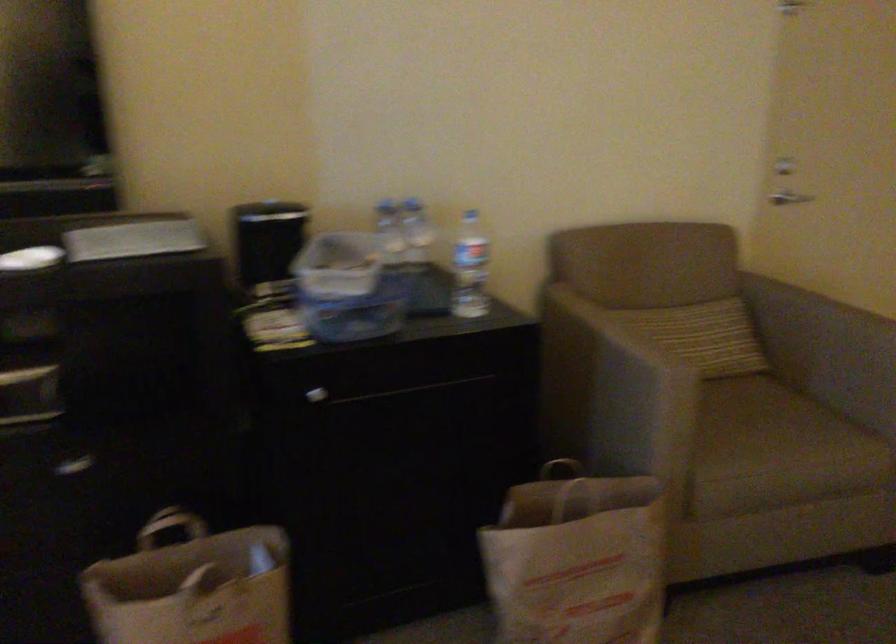
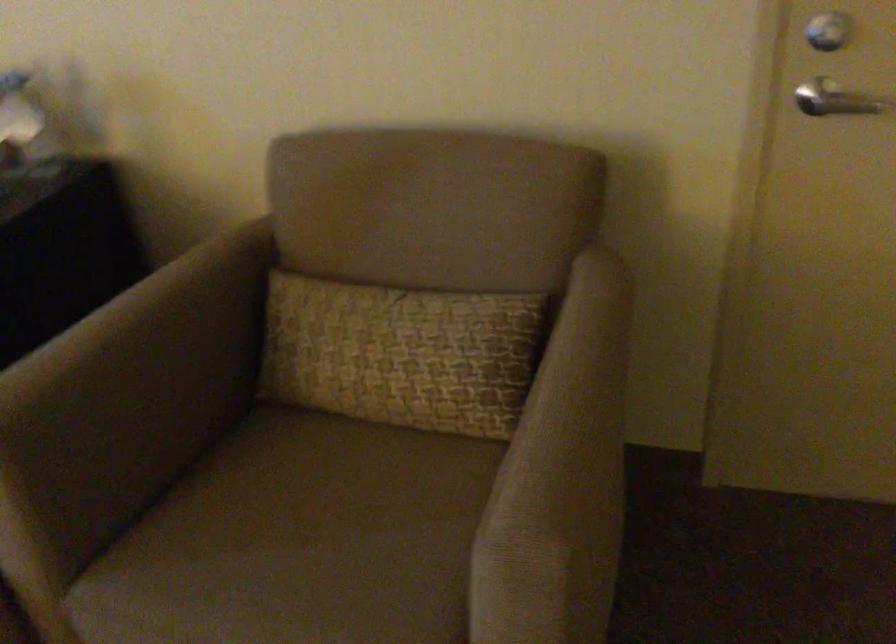
Where in the second image is the point corresponding to pixel 797 156 from the first image?

(829, 31)